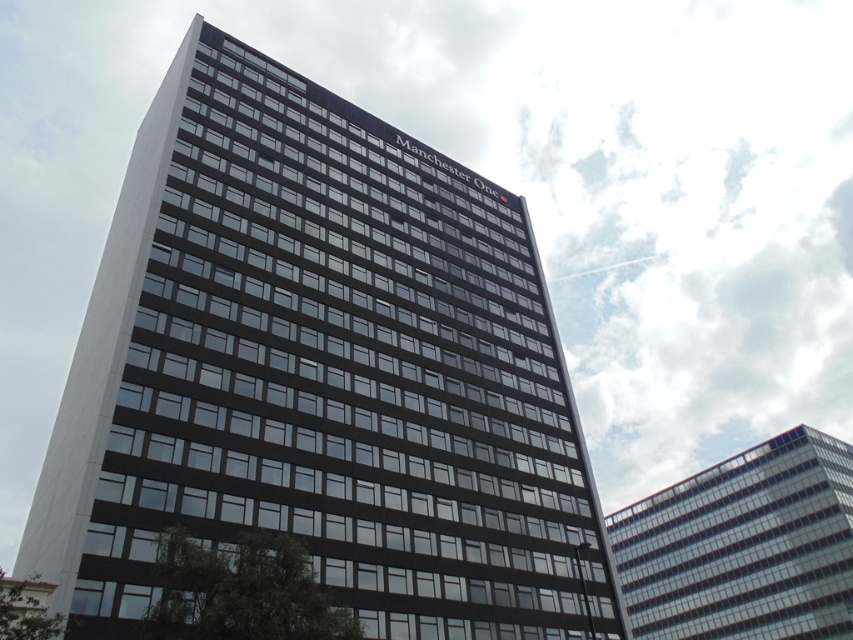
Question: In this image, where is black glass building at center located relative to transparent glass building at upper right?

Choices:
 (A) below
 (B) above

Answer: (B)

Question: Among these points, which one is farthest from the camera?

Choices:
 (A) [x=730, y=500]
 (B) [x=373, y=484]

Answer: (A)

Question: In this image, where is black glass building at center located relative to transparent glass building at upper right?

Choices:
 (A) below
 (B) above

Answer: (B)

Question: Does black glass building at center have a larger size compared to transparent glass building at upper right?

Choices:
 (A) yes
 (B) no

Answer: (B)

Question: Which point appears closest to the camera in this image?

Choices:
 (A) (469, 196)
 (B) (628, 518)

Answer: (A)

Question: Which of the following is the farthest from the observer?

Choices:
 (A) black glass building at center
 (B) transparent glass building at upper right

Answer: (B)